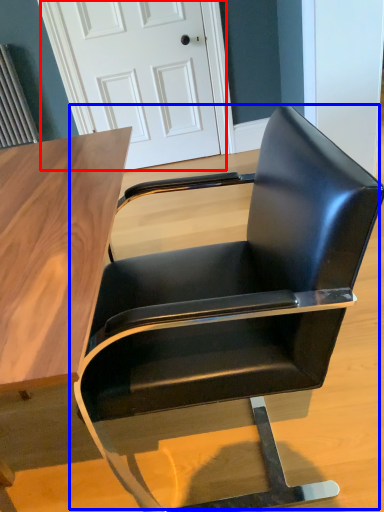
Question: Which point is further to the camera, door (highlighted by a red box) or chair (highlighted by a blue box)?

Choices:
 (A) door
 (B) chair

Answer: (A)